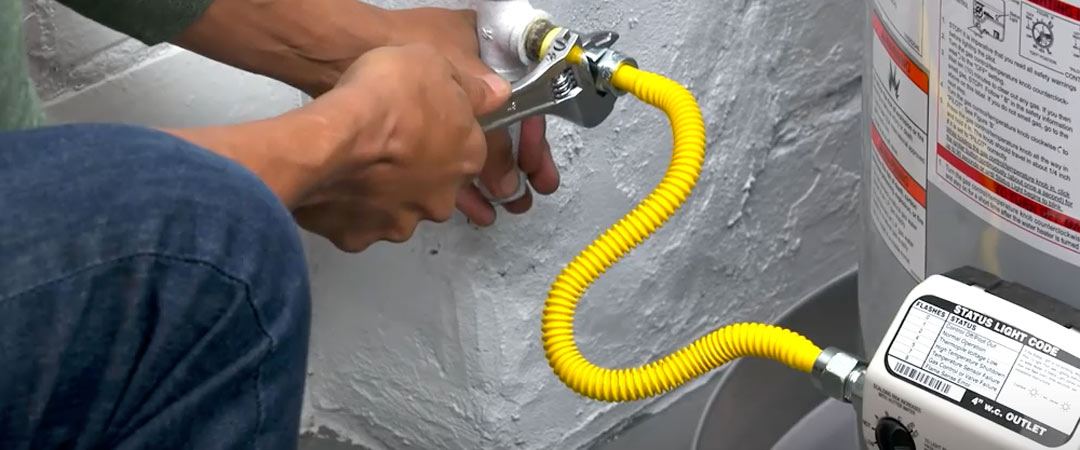
Locate an element on the screen. This screenshot has width=1080, height=450. plaster wall is located at coordinates (835, 133).